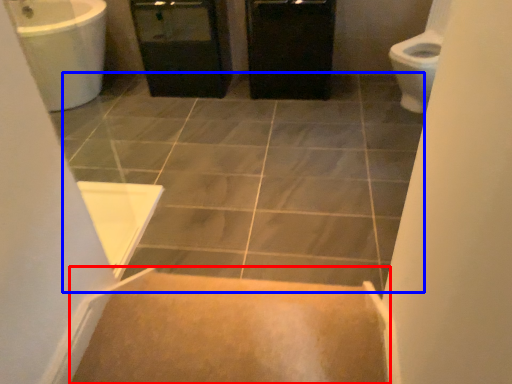
Question: Which point is closer to the camera, stairs (highlighted by a red box) or ceramic tile (highlighted by a blue box)?

Choices:
 (A) stairs
 (B) ceramic tile

Answer: (A)